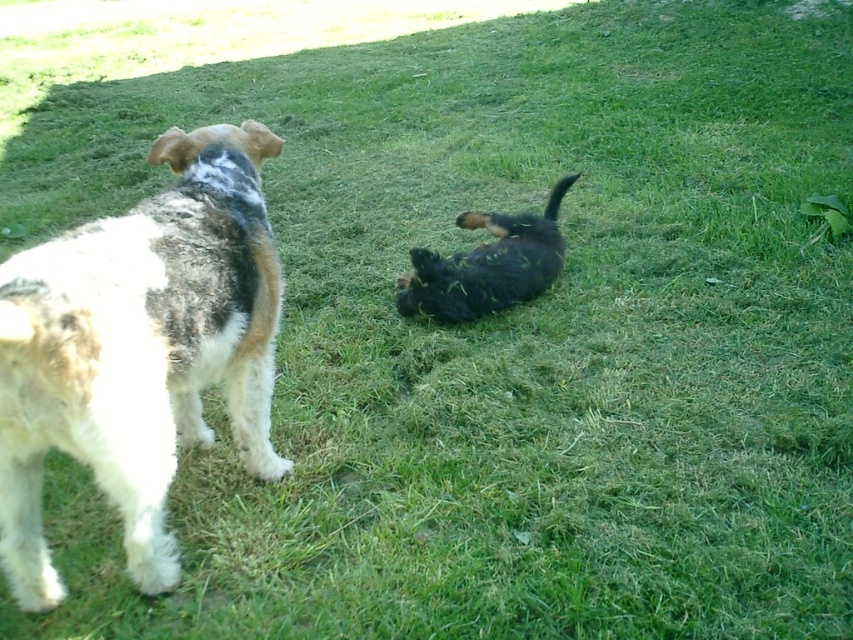
Question: Which point is closer to the camera?

Choices:
 (A) (490, 291)
 (B) (158, 346)

Answer: (B)

Question: Is white fur dog at left wider than black fuzzy dog at center?

Choices:
 (A) no
 (B) yes

Answer: (A)

Question: Is the position of white fur dog at left less distant than that of black fuzzy dog at center?

Choices:
 (A) no
 (B) yes

Answer: (B)

Question: Is white fur dog at left wider than black fuzzy dog at center?

Choices:
 (A) yes
 (B) no

Answer: (B)